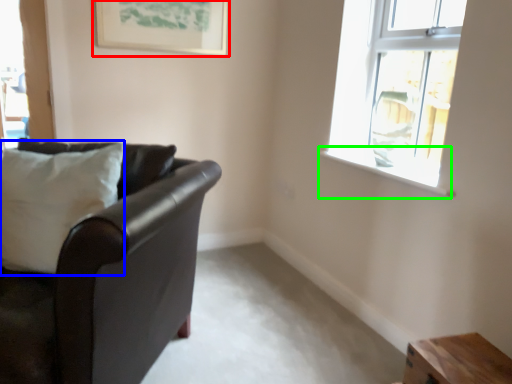
Question: Considering the real-world distances, which object is farthest from picture frame (highlighted by a red box)? pillow (highlighted by a blue box) or window sill (highlighted by a green box)?

Choices:
 (A) pillow
 (B) window sill

Answer: (B)